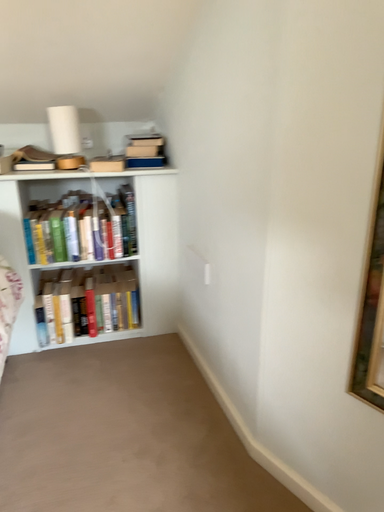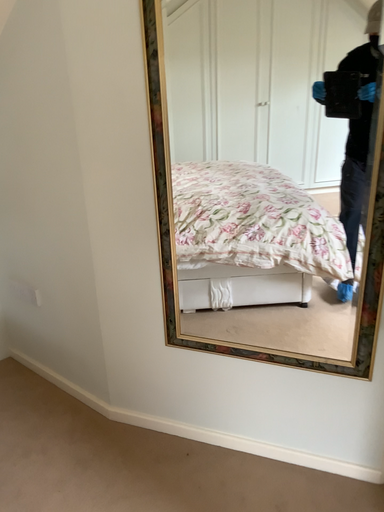
Question: How did the camera likely rotate when shooting the video?

Choices:
 (A) rotated left
 (B) rotated right

Answer: (B)